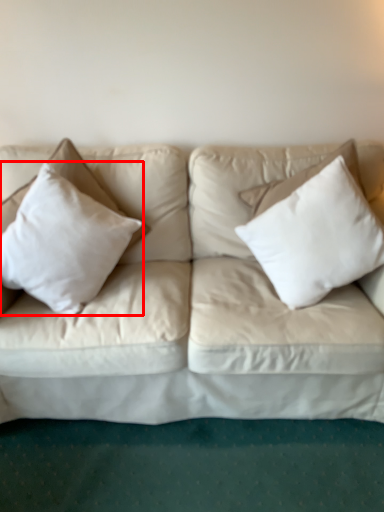
Question: From the image, what is the correct spatial relationship of pillow (annotated by the red box) in relation to pillow?

Choices:
 (A) right
 (B) left

Answer: (B)